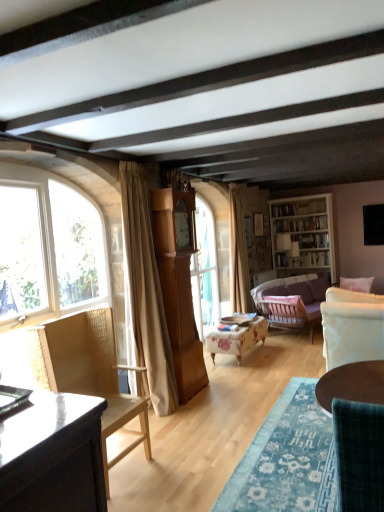
I want to click on vacant space in front of light brown wood grandfather clock at center, so click(197, 410).